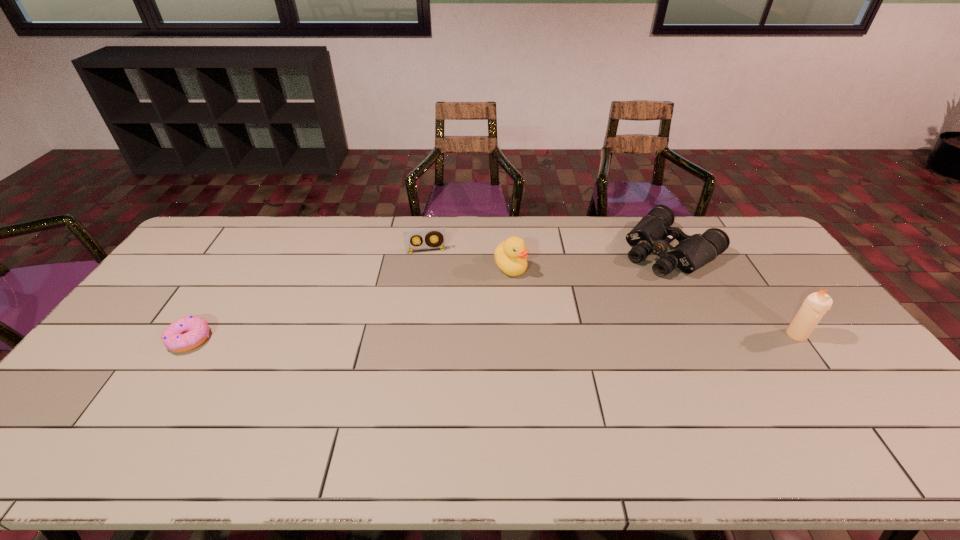
Locate an element on the screen. The width and height of the screenshot is (960, 540). free spot between the videotape and the second tallest object is located at coordinates (468, 259).

Identify the location of empty space that is in between the leftmost object and the third object from left to right. (350, 303).

Locate an element on the screen. The height and width of the screenshot is (540, 960). vacant space that is in between the rightmost object and the fourth object from right to left is located at coordinates (612, 293).

What are the coordinates of `vacant space that is in between the leftmost object and the candle` in the screenshot? It's located at (493, 337).

The height and width of the screenshot is (540, 960). What are the coordinates of `vacant space in between the candle and the second object from left to right` in the screenshot? It's located at (612, 293).

Identify the location of free space between the tallest object and the second object from left to right. (612, 293).

I want to click on vacant space that is in between the fourth shortest object and the shortest object, so click(x=350, y=303).

The height and width of the screenshot is (540, 960). Find the location of `vacant area between the second object from left to right and the doughnut`. vacant area between the second object from left to right and the doughnut is located at coordinates (308, 295).

In order to click on vacant space that is in between the tallest object and the doughnut in this screenshot , I will do `click(493, 337)`.

You are a GUI agent. You are given a task and a screenshot of the screen. Output one action in this format:
    pyautogui.click(x=<x>, y=<y>)
    Task: Click on the empty location between the candle and the second object from left to right
    The width and height of the screenshot is (960, 540).
    Given the screenshot: What is the action you would take?
    pyautogui.click(x=612, y=293)